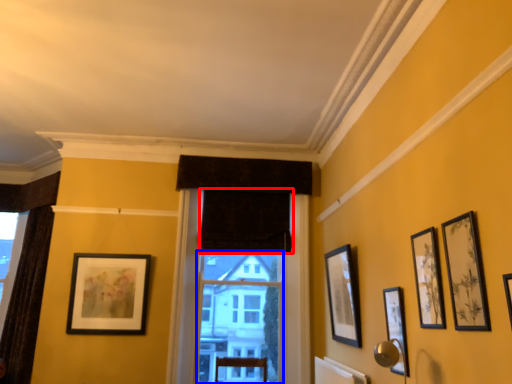
Question: Which object appears farthest to the camera in this image, curtain (highlighted by a red box) or bay window (highlighted by a blue box)?

Choices:
 (A) curtain
 (B) bay window

Answer: (A)